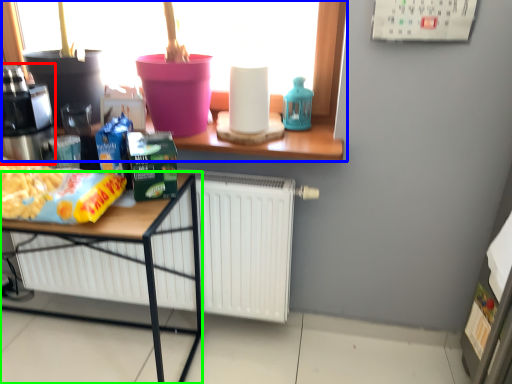
Question: Considering the real-world distances, which object is farthest from coffee machine (highlighted by a red box)? window (highlighted by a blue box) or desk (highlighted by a green box)?

Choices:
 (A) window
 (B) desk

Answer: (A)